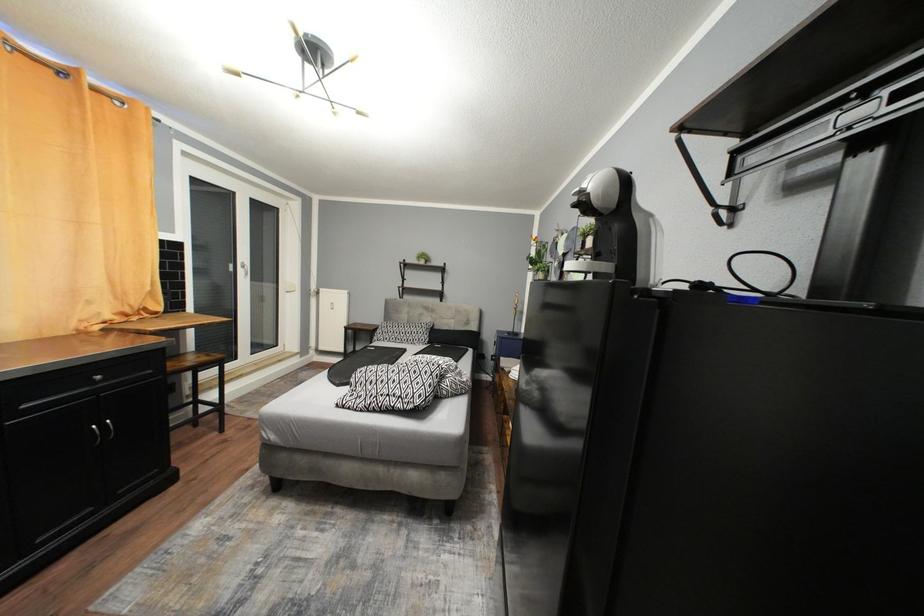
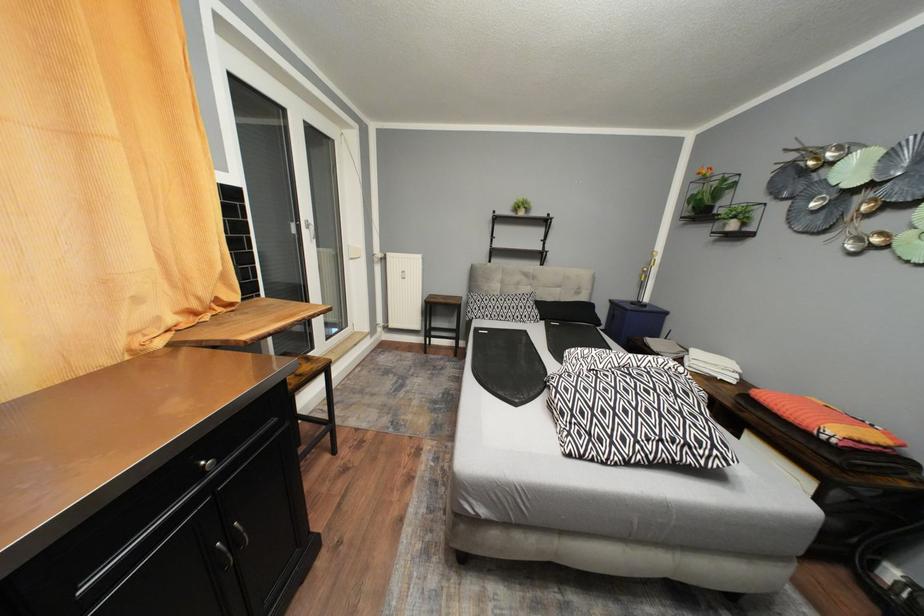
The images are taken continuously from a first-person perspective. In which direction are you moving?

The cameraman moved toward left, forward.